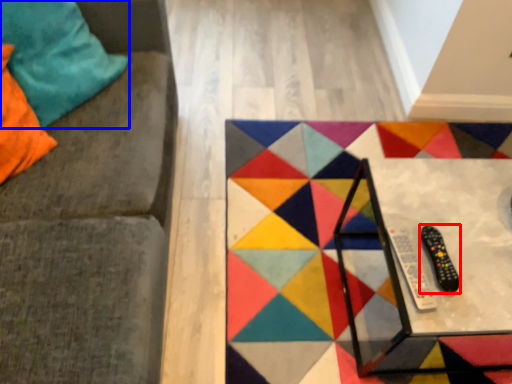
Question: Which object appears closest to the camera in this image, game controller (highlighted by a red box) or pillow (highlighted by a blue box)?

Choices:
 (A) game controller
 (B) pillow

Answer: (A)